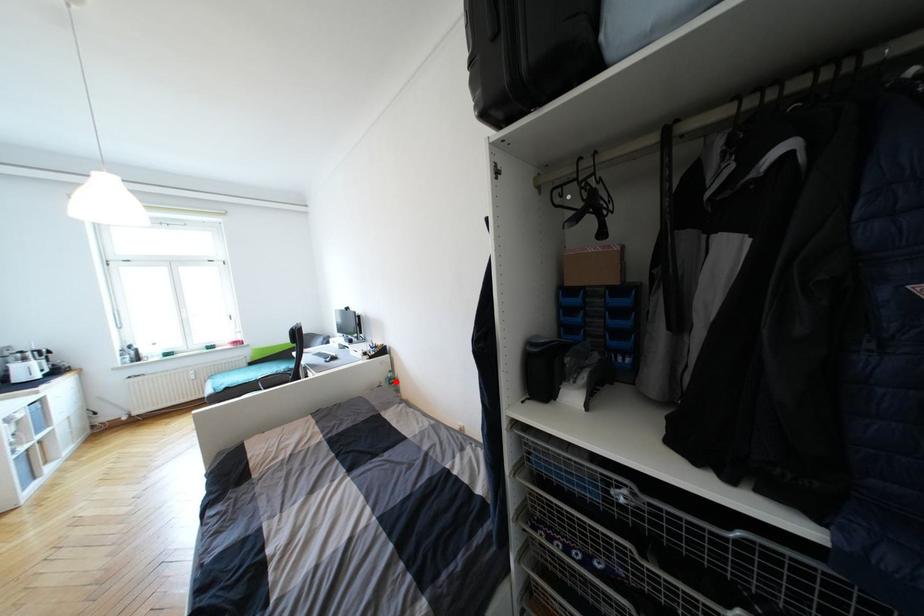
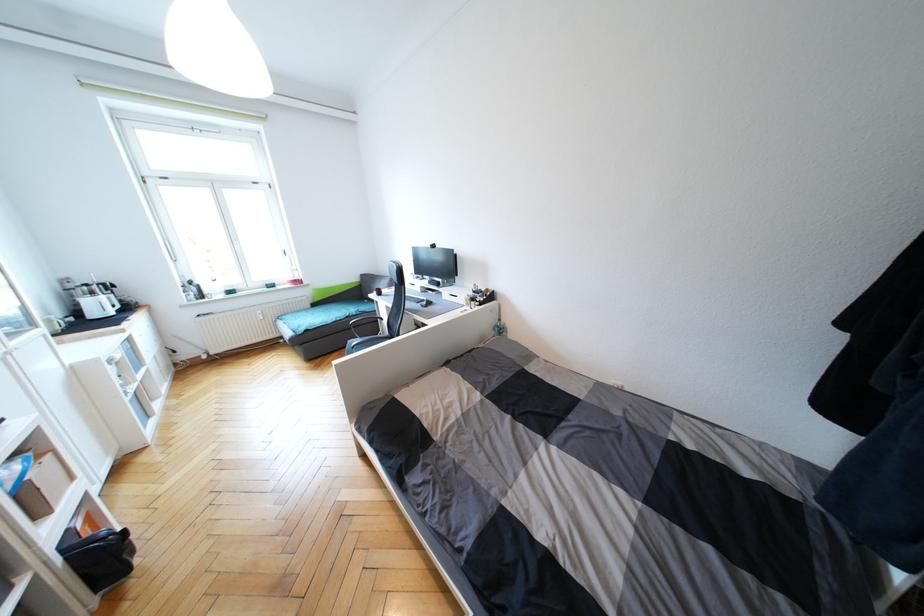
Question: I am providing you with two images of the same scene from different viewpoints. Given a red point in image1, look at the same physical point in image2. Is it:

Choices:
 (A) Closer to the viewpoint
 (B) Farther from the viewpoint

Answer: (A)